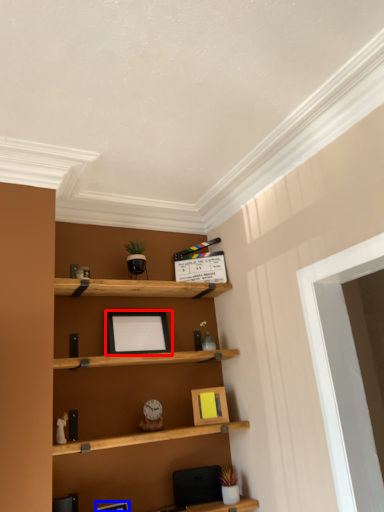
Question: Which object appears closest to the camera in this image, picture frame (highlighted by a red box) or picture frame (highlighted by a blue box)?

Choices:
 (A) picture frame
 (B) picture frame

Answer: (B)